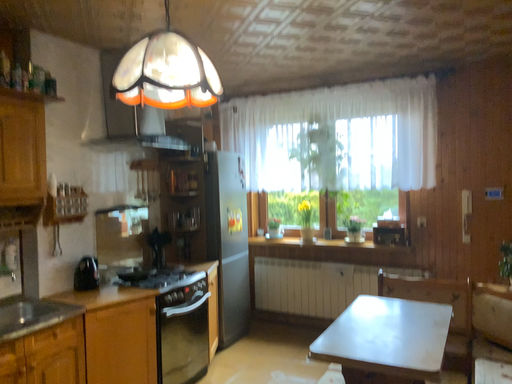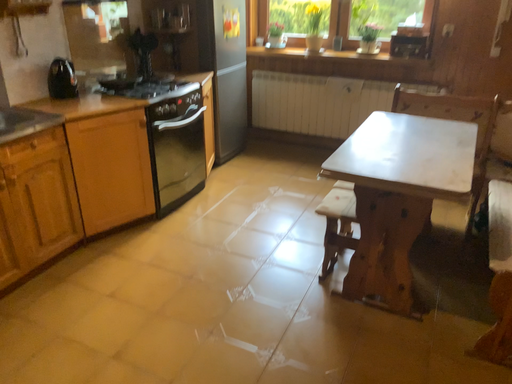
Question: How did the camera likely rotate when shooting the video?

Choices:
 (A) rotated upward
 (B) rotated downward

Answer: (B)